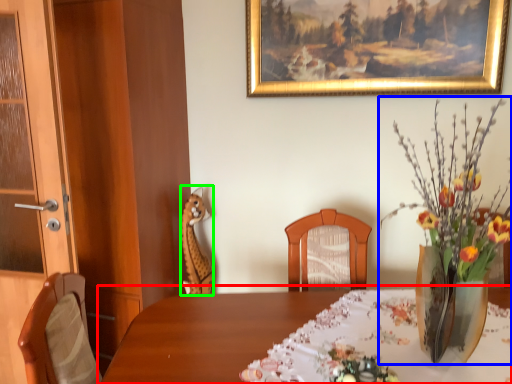
Question: Which object is the closest to the table (highlighted by a red box)? Choose among these: floral arrangement (highlighted by a blue box) or animal (highlighted by a green box).

Choices:
 (A) floral arrangement
 (B) animal

Answer: (A)